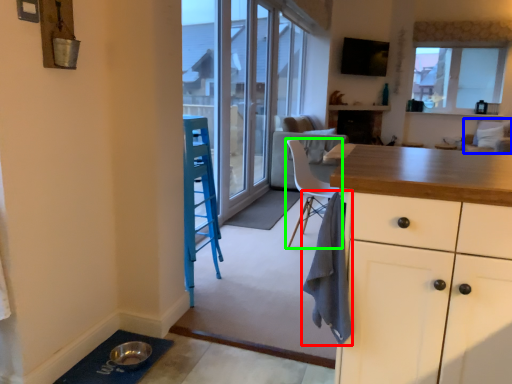
Question: Which object is positioned farthest from cloth (highlighted by a red box)? Select from armchair (highlighted by a blue box) and chair (highlighted by a green box).

Choices:
 (A) armchair
 (B) chair

Answer: (A)